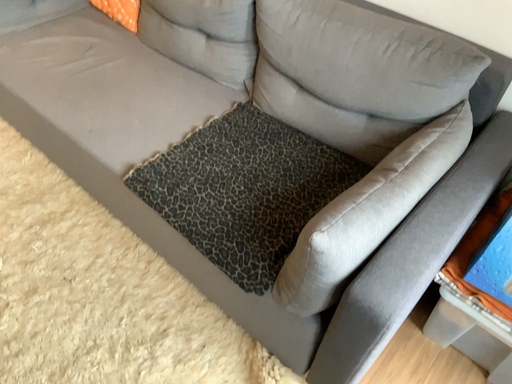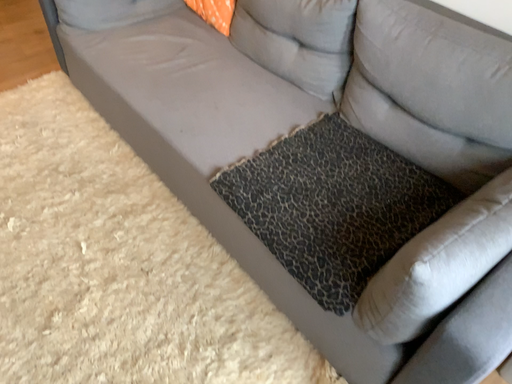
Question: How did the camera likely rotate when shooting the video?

Choices:
 (A) rotated left
 (B) rotated right

Answer: (A)